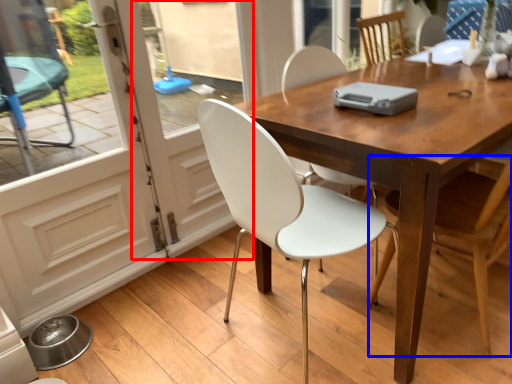
Question: Which of the following is the farthest to the observer, screen door (highlighted by a red box) or chair (highlighted by a blue box)?

Choices:
 (A) screen door
 (B) chair

Answer: (A)